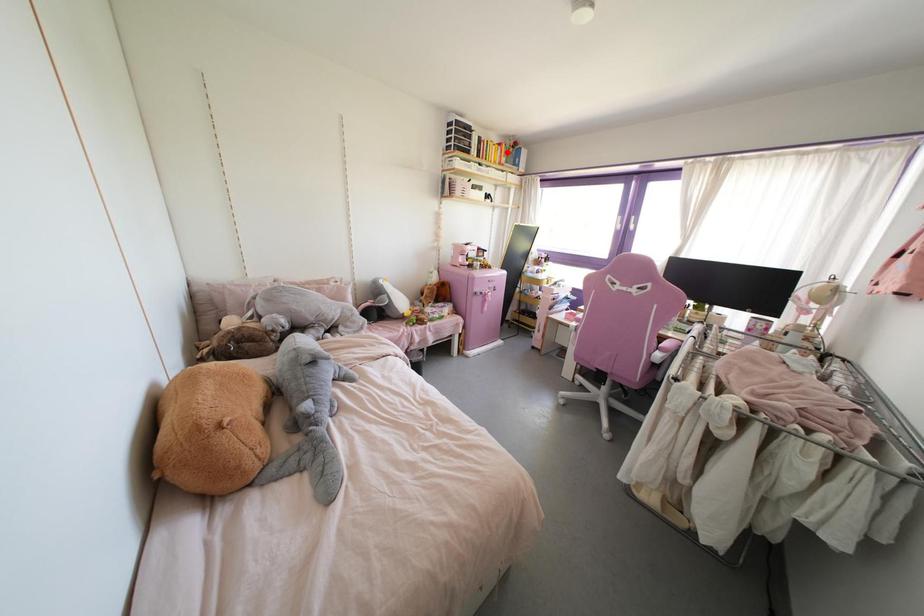
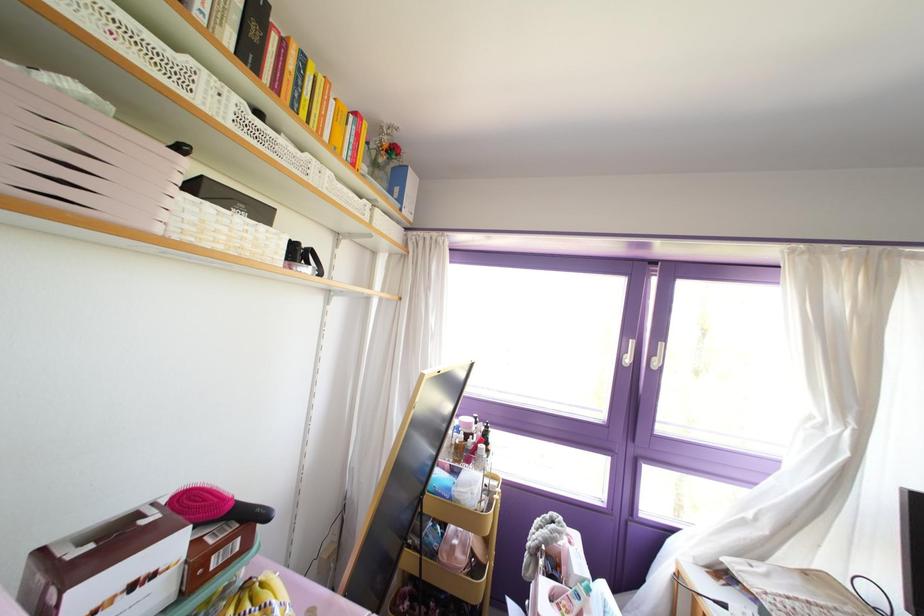
Question: I am providing you with two images of the same scene from different viewpoints. Given a red point in image1, look at the same physical point in image2. Is it:

Choices:
 (A) Closer to the viewpoint
 (B) Farther from the viewpoint

Answer: (B)